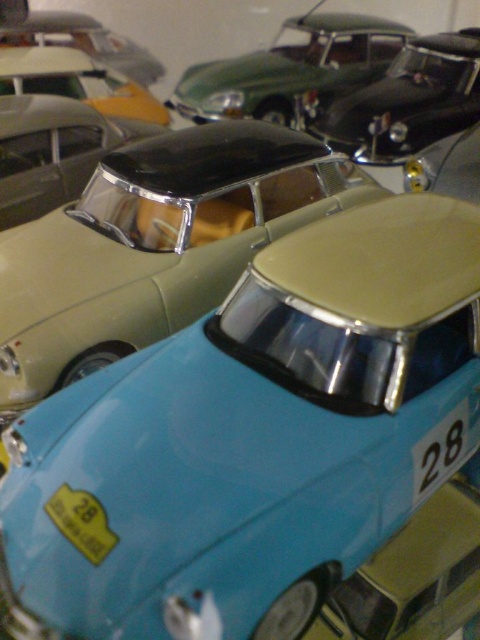
You are standing in front of the display case with the light blue model car. There are two points marked on the case at coordinates point (x=327, y=385) and point (x=62, y=358). Which point is closer to you?

Point (x=327, y=385) is in front of point (x=62, y=358), so it is closer to you.

You are a collector who wants to know if the light blue glossy car at center will fit in a display case that can only accommodate cars smaller than the metallic green car at upper center. Can it fit?

The light blue glossy car at center is bigger than the metallic green car at upper center, so it will not fit in the display case that can only accommodate cars smaller than the metallic green car at upper center.

You are a collector who wants to rearrange the cars in the display case. You need to place a new model between the light blue plastic car at center and the metallic green car at upper center. Based on their current positions, which car should you place the new model closer to?

The light blue plastic car at center is positioned on the left side of metallic green car at upper center, so you should place the new model between them closer to the light blue plastic car at center to maintain the left to right order.